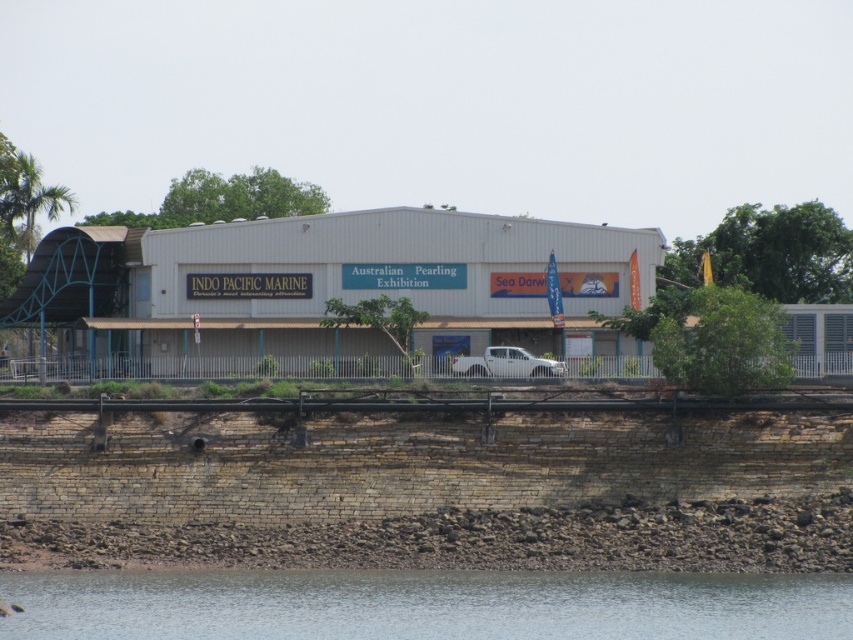
You are standing at the base of the building and want to walk towards the two points marked on the image. Which point, point (734, 634) or point (554, 362), is closer to you?

Point (734, 634) is in front of point (554, 362), so it is closer to you.

You are a photographer planning to capture the entire scene of the building and its surroundings. Given that your camera frame can only accommodate objects up to the size of the white matte truck at center, will the clear water at lower center fit within the frame?

The clear water at lower center is bigger than the white matte truck at center, so it will not fit within the camera frame designed to accommodate objects up to the size of the white matte truck at center.

You are standing at the edge of the rocky shoreline looking towards the building. Where is the clear water at lower center in relation to your position?

The clear water at lower center is located at point (422,604), which places it directly in front of you at the lower central part of the scene.